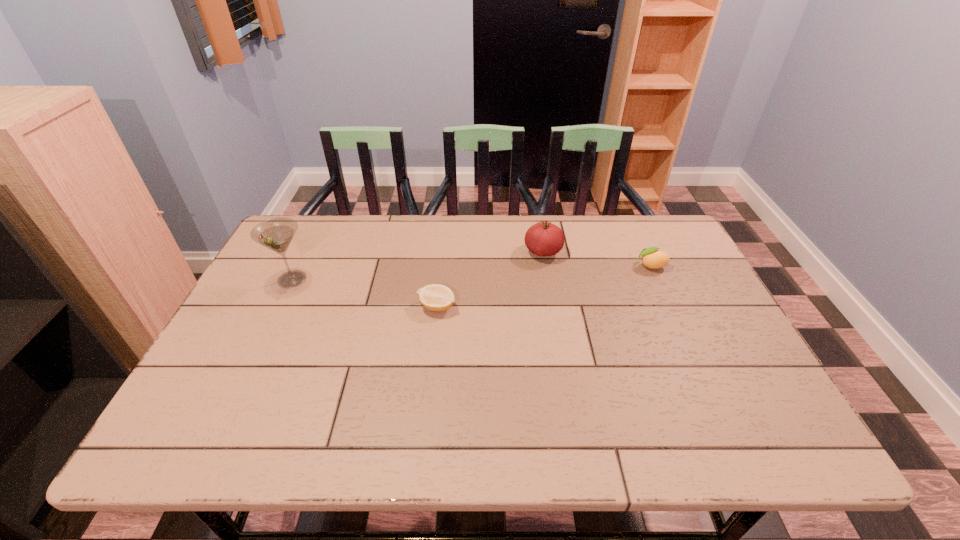
You are a GUI agent. You are given a task and a screenshot of the screen. Output one action in this format:
    pyautogui.click(x=<x>, y=<y>)
    Task: Click on the free space between the tomato and the martini
    
    Given the screenshot: What is the action you would take?
    pyautogui.click(x=418, y=266)

The width and height of the screenshot is (960, 540). I want to click on vacant space in between the leftmost object and the rightmost object, so click(471, 273).

This screenshot has height=540, width=960. In order to click on free space between the taller lemon and the tomato in this screenshot , I will do `click(597, 259)`.

This screenshot has width=960, height=540. I want to click on free point between the martini and the nearest object, so (365, 293).

This screenshot has width=960, height=540. In order to click on free spot between the taller lemon and the shortest object in this screenshot , I will do `click(543, 286)`.

Locate an element on the screen. Image resolution: width=960 pixels, height=540 pixels. object identified as the third closest to the third tallest object is located at coordinates (276, 234).

Select which object appears as the closest to the third shortest object. Please provide its 2D coordinates. Your answer should be formatted as a tuple, i.e. [(x, y)], where the tuple contains the x and y coordinates of a point satisfying the conditions above.

[(653, 258)]

You are a GUI agent. You are given a task and a screenshot of the screen. Output one action in this format:
    pyautogui.click(x=<x>, y=<y>)
    Task: Click on the free space in the image that satisfies the following two spatial constraints: 1. on the front side of the shortest object; 2. on the left side of the martini
    The height and width of the screenshot is (540, 960).
    Given the screenshot: What is the action you would take?
    pyautogui.click(x=278, y=307)

The width and height of the screenshot is (960, 540). What are the coordinates of `vacant region that satisfies the following two spatial constraints: 1. on the front side of the leftmost object; 2. on the right side of the third object from right to left` in the screenshot? It's located at (278, 307).